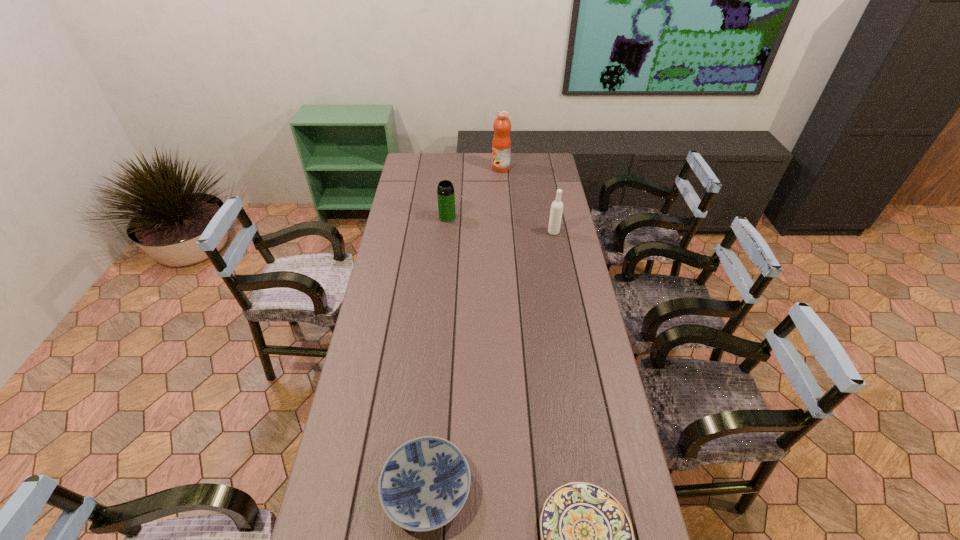
I want to click on vacant space located from the spout of the fourth nearest object, so click(x=444, y=247).

This screenshot has height=540, width=960. Identify the location of vacant position located 0.210m on the right of the fourth tallest object. (553, 490).

Identify the location of object located at the far edge. (501, 145).

Find the location of a particular element. This screenshot has width=960, height=540. object that is at the left edge is located at coordinates (424, 484).

I want to click on object at the right edge, so click(556, 211).

In the image, there is a desktop. At what (x,y) coordinates should I click in order to perform the action: click on free region at the left edge. Please return your answer as a coordinate pair (x, y). The image size is (960, 540). Looking at the image, I should click on (362, 463).

Identify the location of vacant space at the right edge of the desktop. point(563,239).

The image size is (960, 540). I want to click on vacant space at the far left corner, so click(431, 153).

Image resolution: width=960 pixels, height=540 pixels. I want to click on empty space between the fourth nearest object and the taller plate, so click(437, 354).

At what (x,y) coordinates should I click in order to perform the action: click on vacant area between the second farthest object and the left plate. Please return your answer as a coordinate pair (x, y). Image resolution: width=960 pixels, height=540 pixels. Looking at the image, I should click on (437, 354).